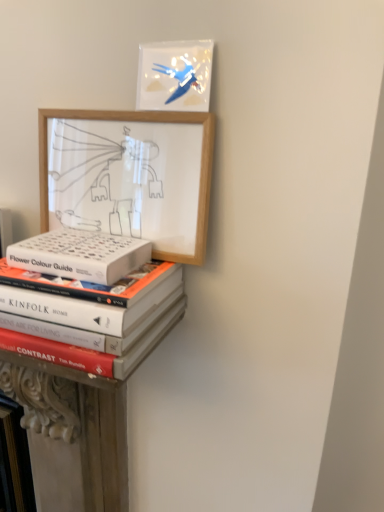
Question: Does white matte book at center contain hardcover books at lower left?

Choices:
 (A) no
 (B) yes

Answer: (A)

Question: Is white matte book at center smaller than hardcover books at lower left?

Choices:
 (A) no
 (B) yes

Answer: (B)

Question: Is white matte book at center behind hardcover books at lower left?

Choices:
 (A) yes
 (B) no

Answer: (A)

Question: Is white matte book at center taller than hardcover books at lower left?

Choices:
 (A) yes
 (B) no

Answer: (B)

Question: Is white matte book at center positioned with its back to hardcover books at lower left?

Choices:
 (A) no
 (B) yes

Answer: (A)

Question: From the image's perspective, is hardcover books at lower left located above or below wooden picture frame at upper left, the 2th picture frame when ordered from top to bottom?

Choices:
 (A) above
 (B) below

Answer: (B)

Question: Is hardcover books at lower left in front of or behind wooden picture frame at upper left, the 2th picture frame when ordered from top to bottom, in the image?

Choices:
 (A) front
 (B) behind

Answer: (A)

Question: From a real-world perspective, relative to wooden picture frame at upper left, the 2th picture frame when ordered from top to bottom, is hardcover books at lower left vertically above or below?

Choices:
 (A) above
 (B) below

Answer: (B)

Question: Is point (39, 303) closer or farther from the camera than point (173, 250)?

Choices:
 (A) closer
 (B) farther

Answer: (A)

Question: From the image's perspective, is matte plastic picture frame at upper center, the 1th picture frame when ordered from top to bottom, positioned above or below hardcover books at lower left?

Choices:
 (A) below
 (B) above

Answer: (B)

Question: Would you say matte plastic picture frame at upper center, positioned as the second picture frame in bottom-to-top order, is to the left or to the right of hardcover books at lower left in the picture?

Choices:
 (A) right
 (B) left

Answer: (A)

Question: Considering their positions, is matte plastic picture frame at upper center, positioned as the second picture frame in bottom-to-top order, located in front of or behind hardcover books at lower left?

Choices:
 (A) behind
 (B) front

Answer: (A)

Question: Would you say matte plastic picture frame at upper center, the 1th picture frame when ordered from top to bottom, is inside or outside hardcover books at lower left?

Choices:
 (A) outside
 (B) inside

Answer: (A)

Question: Is matte plastic picture frame at upper center, positioned as the second picture frame in bottom-to-top order, inside the boundaries of wooden picture frame at upper left, the 1th picture frame in the bottom-to-top sequence, or outside?

Choices:
 (A) inside
 (B) outside

Answer: (B)

Question: In the image, is matte plastic picture frame at upper center, positioned as the second picture frame in bottom-to-top order, on the left side or the right side of wooden picture frame at upper left, the 1th picture frame in the bottom-to-top sequence?

Choices:
 (A) left
 (B) right

Answer: (B)